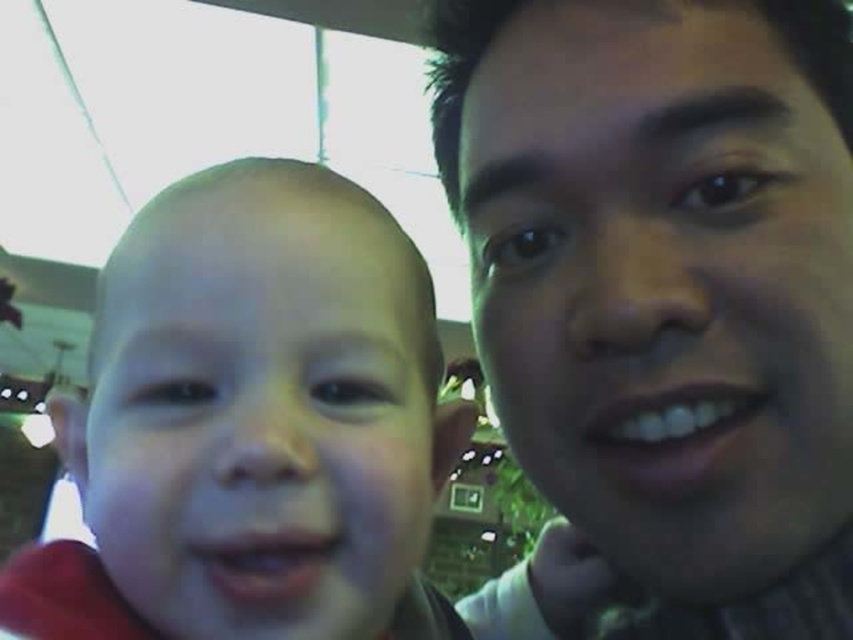
You are a photographer trying to adjust your camera focus. You notice two points in the image at coordinates point (469, 625) and point (183, 541). Which point is closer to the camera lens?

Point (469, 625) is further to the viewer than point (183, 541), so the point closer to the camera lens is point (183, 541).

You are a photographer trying to adjust the focus of your camera to capture the smooth skin face at center in this selfie. The camera requires the exact coordinates to ensure sharpness. What are the coordinates where you should focus the camera?

The coordinates for focusing the camera should be set to point (662,301) as that is the 2D location of the smooth skin face at center.